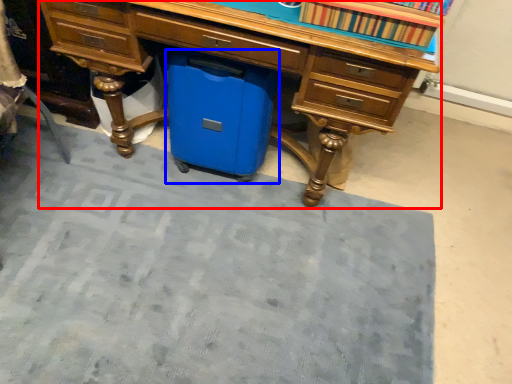
Question: Which object appears farthest to the camera in this image, desk (highlighted by a red box) or cooler (highlighted by a blue box)?

Choices:
 (A) desk
 (B) cooler

Answer: (B)